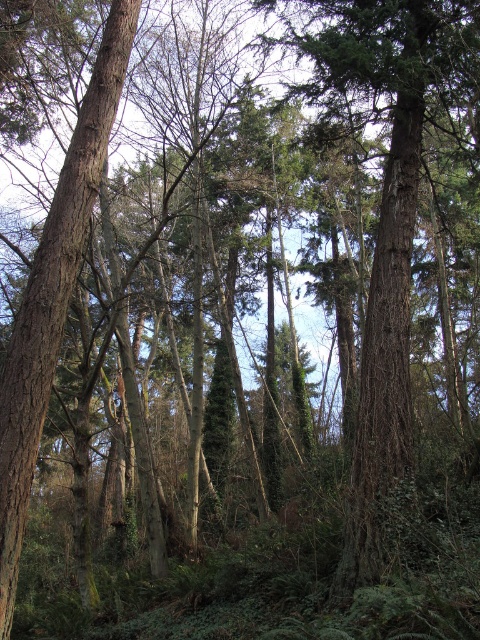
Question: Which point is closer to the camera taking this photo?

Choices:
 (A) [87, 129]
 (B) [376, 534]

Answer: (A)

Question: Is green rough bark tree at center closer to camera compared to brown rough bark tree at left?

Choices:
 (A) no
 (B) yes

Answer: (A)

Question: Can you confirm if green rough bark tree at center is smaller than brown rough bark tree at left?

Choices:
 (A) yes
 (B) no

Answer: (B)

Question: Can you confirm if green rough bark tree at center is wider than brown rough bark tree at left?

Choices:
 (A) no
 (B) yes

Answer: (B)

Question: Which point is closer to the camera?

Choices:
 (A) (6, 412)
 (B) (360, 506)

Answer: (A)